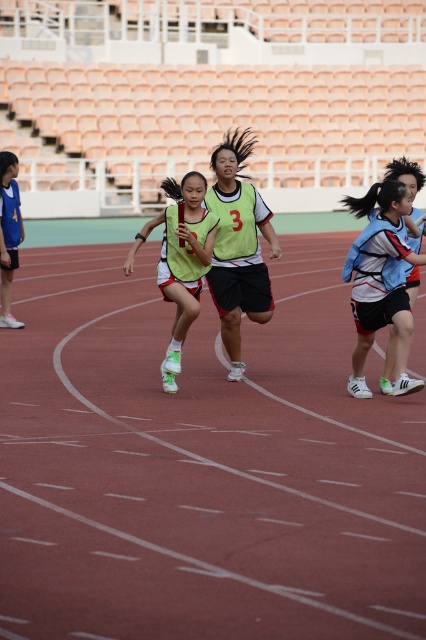
You are a photographer positioned at the edge of the field. You notice the red rubber track at center and the green matte jersey at center. Which object is closer to the ground?

The red rubber track at center has a lesser height compared to green matte jersey at center, so the red rubber track at center is closer to the ground.

You are a spectator at the track and field event. You notice the red rubber track at center and the light blue jersey at center. Which object is closer to you?

The red rubber track at center is closer to you because it is in front of the light blue jersey at center.

You are a coach observing a relay race. You notice two athletes wearing light blue jersey at center and green matte jersey at center. Which athlete might be in a better position to receive the baton smoothly?

The light blue jersey at center is shorter than the green matte jersey at center, so the light blue jersey at center might be in a better position to receive the baton smoothly as they can reach lower if needed.